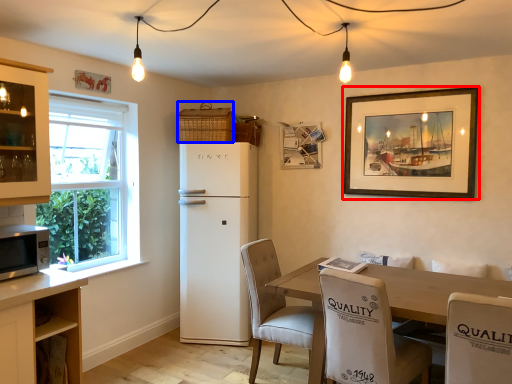
Question: Which object appears farthest to the camera in this image, picture frame (highlighted by a red box) or basket (highlighted by a blue box)?

Choices:
 (A) picture frame
 (B) basket

Answer: (B)